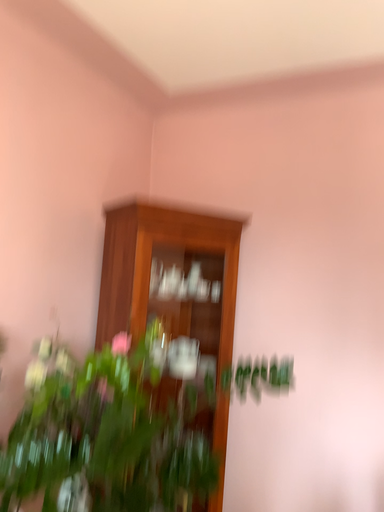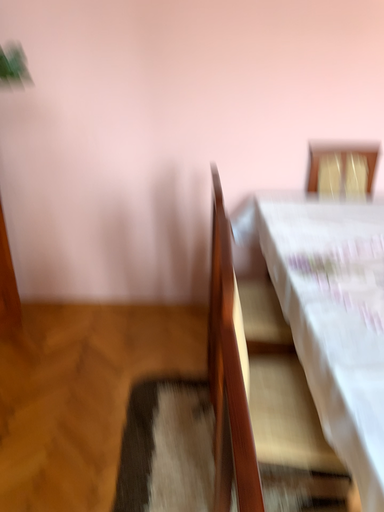
Question: How did the camera likely rotate when shooting the video?

Choices:
 (A) rotated right
 (B) rotated left

Answer: (A)